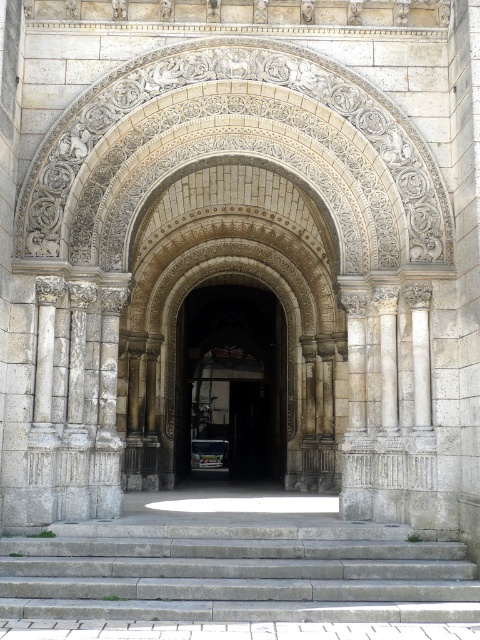
Is point (220, 552) behind point (222, 451)?

No, it is in front of (222, 451).

This screenshot has height=640, width=480. What do you see at coordinates (236, 573) in the screenshot? I see `gray concrete stairs at lower center` at bounding box center [236, 573].

Locate an element on the screen. gray concrete stairs at lower center is located at coordinates (236, 573).